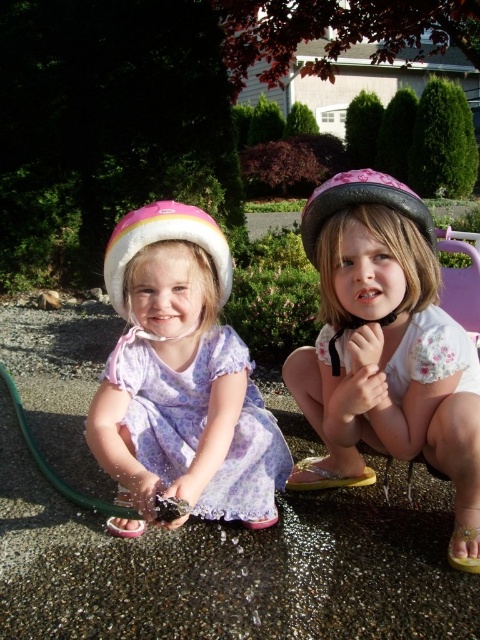
You are a parent trying to determine which item is narrower between the pink glossy helmet at center and the lavender floral dress at center. Based on the scene, which one is narrower?

The pink glossy helmet at center is narrower than the lavender floral dress at center because it has a lesser width compared to the lavender floral dress at center.